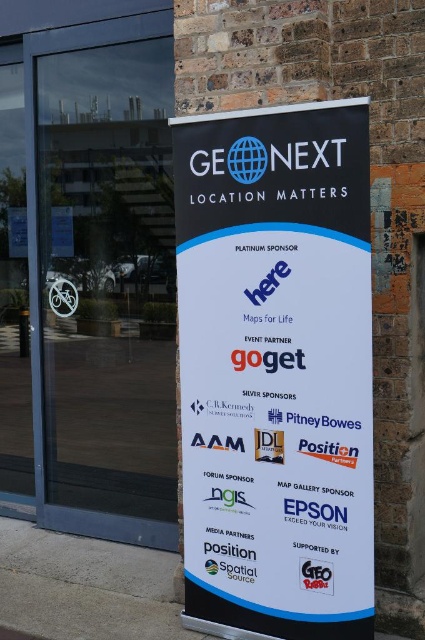
Who is positioned more to the left, blue glossy globe at upper center or matte red logo at center?

From the viewer's perspective, blue glossy globe at upper center appears more on the left side.

Can you confirm if blue glossy globe at upper center is positioned to the right of matte red logo at center?

No, blue glossy globe at upper center is not to the right of matte red logo at center.

This screenshot has height=640, width=425. Identify the location of blue glossy globe at upper center. (246, 160).

Image resolution: width=425 pixels, height=640 pixels. What do you see at coordinates (85, 586) in the screenshot?
I see `gray concrete pavement at lower center` at bounding box center [85, 586].

Is gray concrete pavement at lower center to the left of matte red logo at center from the viewer's perspective?

Indeed, gray concrete pavement at lower center is positioned on the left side of matte red logo at center.

What are the coordinates of `gray concrete pavement at lower center` in the screenshot? It's located at (85, 586).

Find the location of a particular element. gray concrete pavement at lower center is located at coordinates (85, 586).

Can you confirm if white paper sign at center is bigger than blue glossy globe at upper center?

Indeed, white paper sign at center has a larger size compared to blue glossy globe at upper center.

Looking at this image, who is more distant from viewer, (334, 573) or (241, 164)?

Point (241, 164)

Locate an element on the screen. This screenshot has width=425, height=640. white paper sign at center is located at coordinates (275, 371).